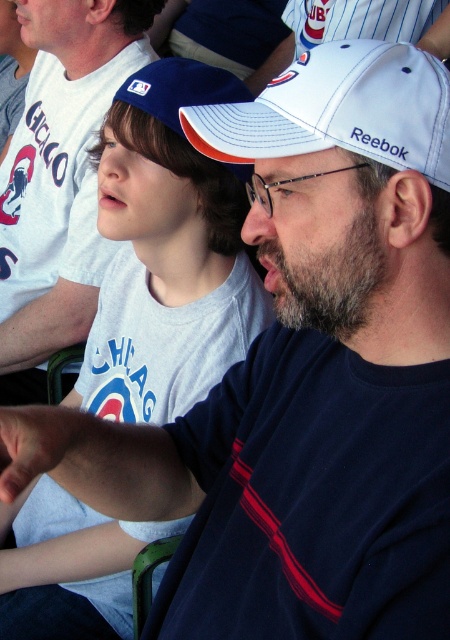
Question: Which point is closer to the camera?

Choices:
 (A) (226, 132)
 (B) (17, 573)

Answer: (A)

Question: Is white cotton shirt at upper left to the right of white matte baseball cap at center from the viewer's perspective?

Choices:
 (A) yes
 (B) no

Answer: (B)

Question: Which object appears closest to the camera in this image?

Choices:
 (A) white matte baseball cap at center
 (B) white matte baseball cap at upper center

Answer: (A)

Question: Does white matte baseball cap at upper center appear over white matte baseball cap at center?

Choices:
 (A) no
 (B) yes

Answer: (B)

Question: In this image, where is white matte baseball cap at upper center located relative to white matte baseball cap at center?

Choices:
 (A) left
 (B) right

Answer: (A)

Question: Among these objects, which one is nearest to the camera?

Choices:
 (A) white cotton shirt at upper left
 (B) white matte baseball cap at upper center
 (C) white matte baseball cap at center

Answer: (C)